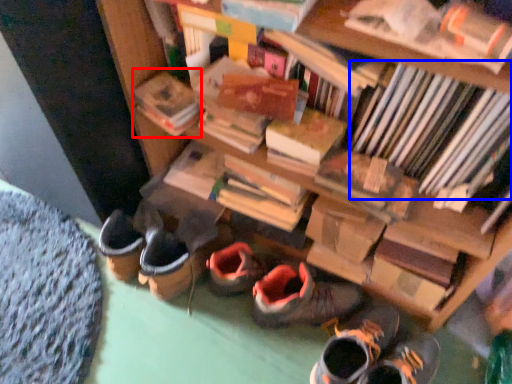
Question: Which object appears farthest to the camera in this image, paperback book (highlighted by a red box) or book (highlighted by a blue box)?

Choices:
 (A) paperback book
 (B) book

Answer: (A)